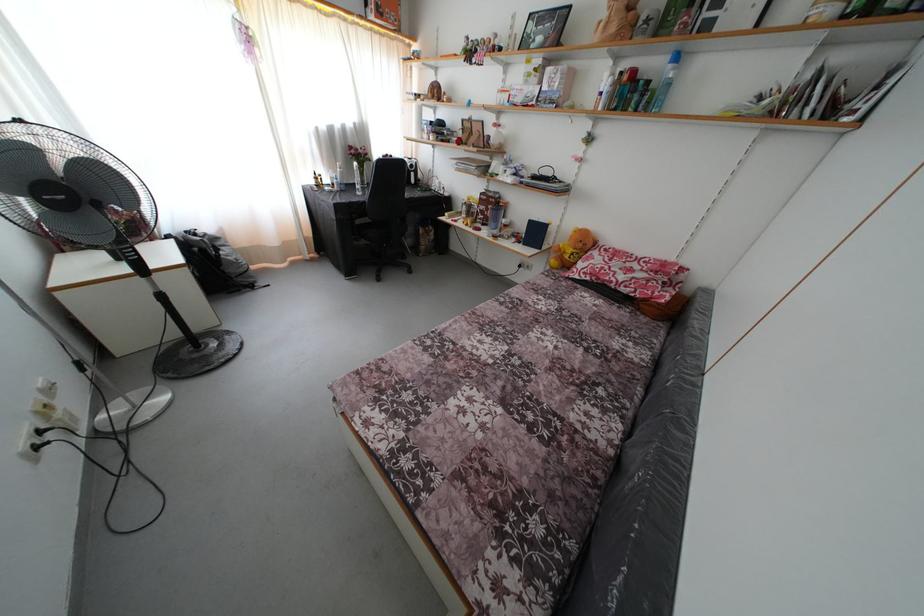
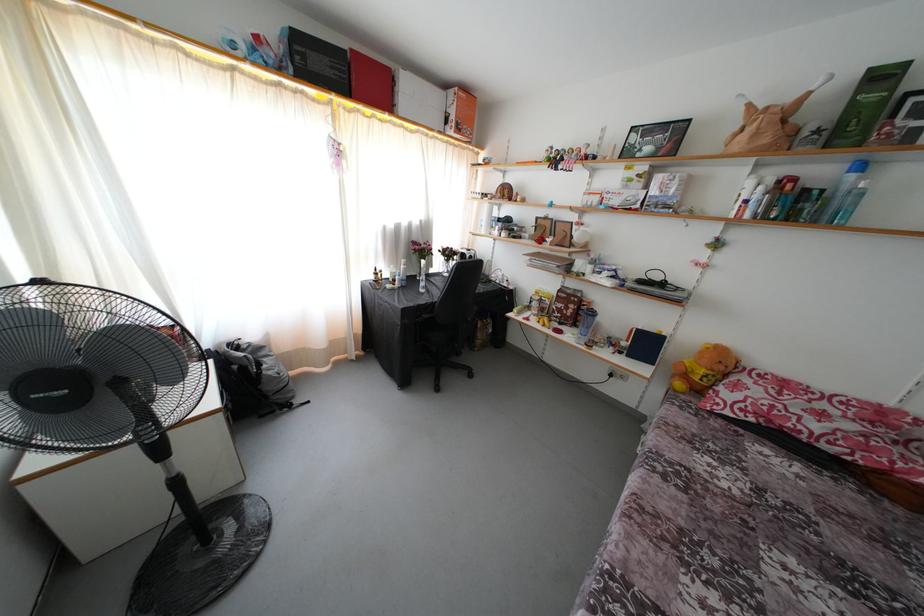
In the second image, find the point that corresponds to point (585, 251) in the first image.

(726, 373)